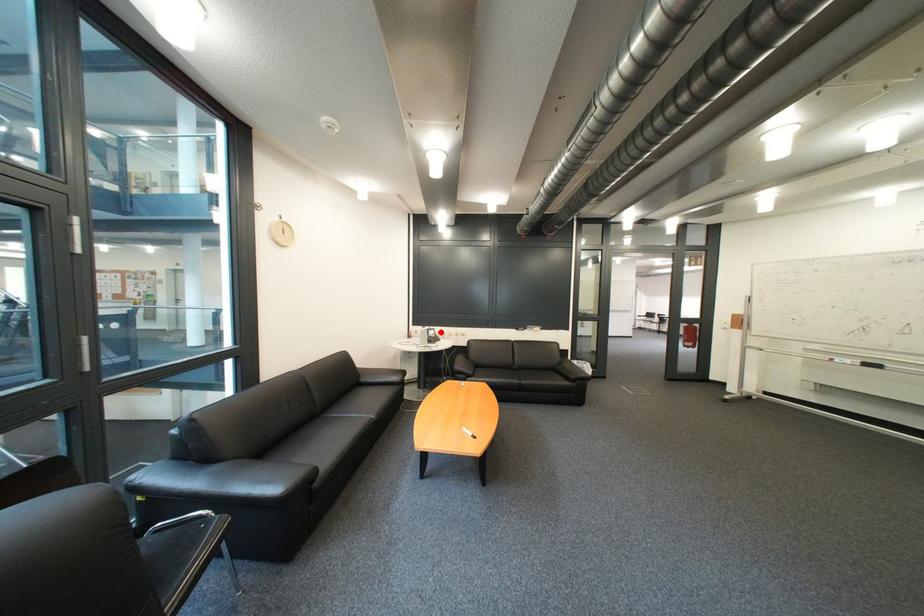
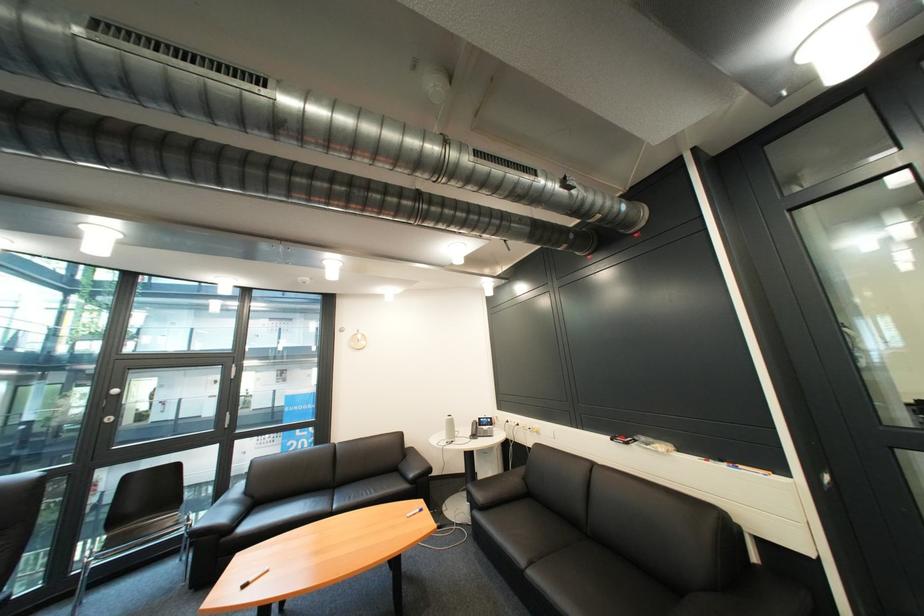
In the second image, find the point that corresponds to the highlighted location in the first image.

(492, 419)